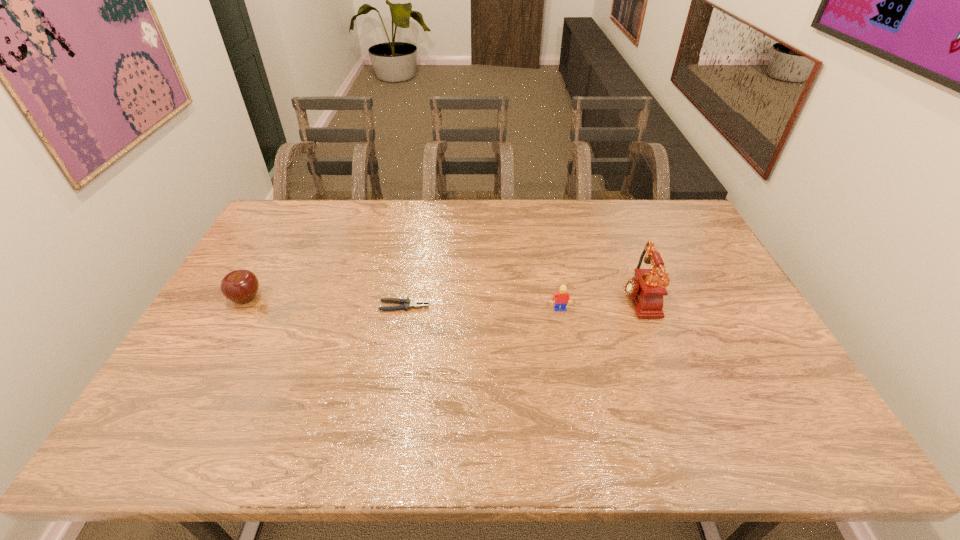
Identify the location of free space located 0.230m on the front-facing side of the Lego. (571, 382).

This screenshot has width=960, height=540. Find the location of `vacant position located at the gripping part of the pliers`. vacant position located at the gripping part of the pliers is located at coordinates (446, 306).

Where is `object situated at the left edge`? Image resolution: width=960 pixels, height=540 pixels. object situated at the left edge is located at coordinates (240, 286).

Where is `vacant point at the far edge`? The image size is (960, 540). vacant point at the far edge is located at coordinates click(424, 216).

Find the location of a particular element. This screenshot has width=960, height=540. free space at the near edge is located at coordinates (380, 441).

The image size is (960, 540). I want to click on free point at the left edge, so click(211, 416).

Identify the location of vacant space at the right edge of the desktop. This screenshot has height=540, width=960. (742, 303).

Where is `free space that is in between the shortest object and the third object from left to right`? The image size is (960, 540). free space that is in between the shortest object and the third object from left to right is located at coordinates (482, 308).

Where is `vacant space in between the second object from right to left and the tallest object`? This screenshot has height=540, width=960. vacant space in between the second object from right to left and the tallest object is located at coordinates (598, 304).

The image size is (960, 540). Identify the location of free space between the telephone and the Lego. (598, 304).